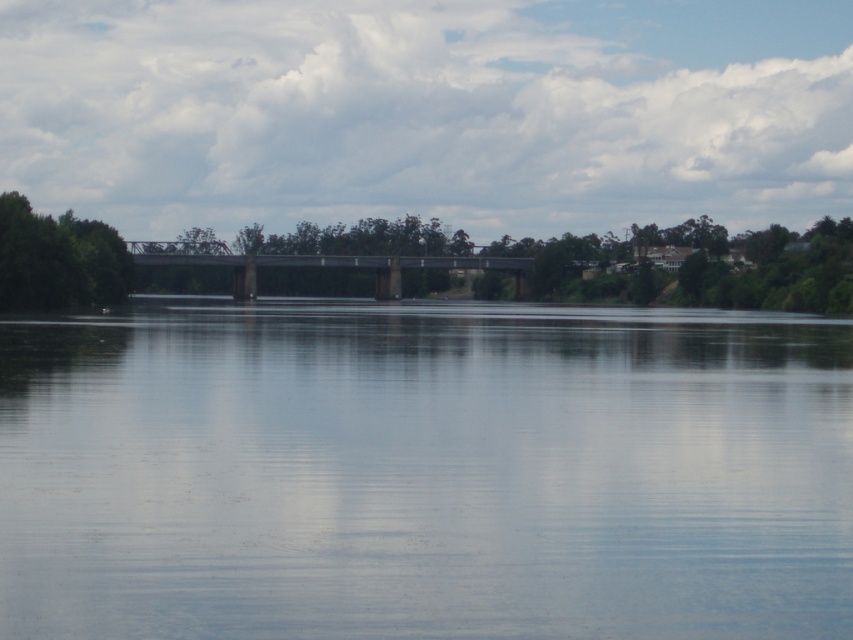
Question: Which of the following is the farthest from the observer?

Choices:
 (A) (473, 259)
 (B) (107, 256)

Answer: (A)

Question: Observing the image, what is the correct spatial positioning of transparent water at center in reference to green leafy tree at left?

Choices:
 (A) below
 (B) above

Answer: (A)

Question: Which object appears farthest from the camera in this image?

Choices:
 (A) green leafy tree at left
 (B) transparent water at center

Answer: (A)

Question: Which point appears farthest from the camera in this image?

Choices:
 (A) (27, 273)
 (B) (538, 490)
 (C) (241, 280)

Answer: (C)

Question: Can you confirm if transparent water at center is positioned below green leafy tree at left?

Choices:
 (A) no
 (B) yes

Answer: (B)

Question: Is green leafy tree at left above gray metallic bridge at center?

Choices:
 (A) yes
 (B) no

Answer: (B)